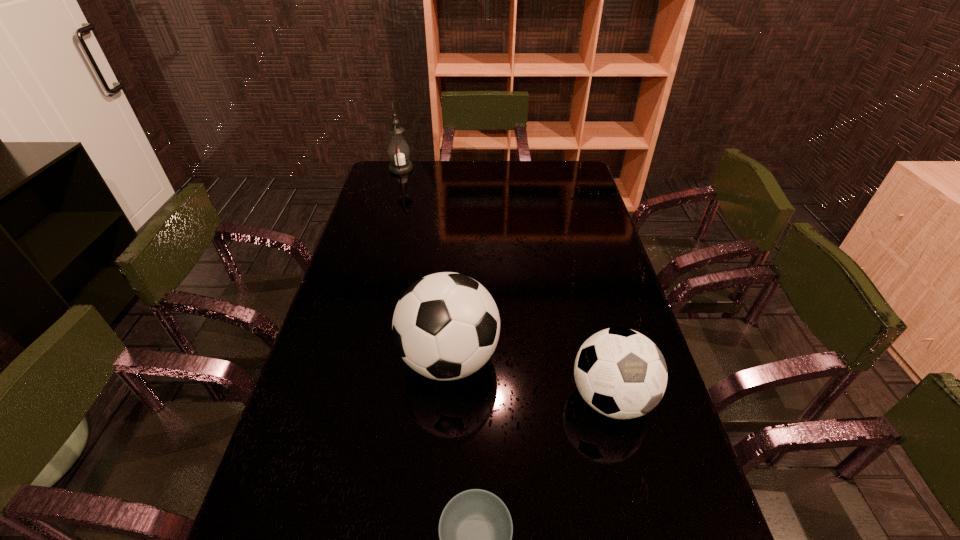
The width and height of the screenshot is (960, 540). Find the location of `oil lamp`. oil lamp is located at coordinates (398, 150).

Identify the location of the leftmost object. This screenshot has height=540, width=960. (398, 150).

You are a GUI agent. You are given a task and a screenshot of the screen. Output one action in this format:
    pyautogui.click(x=<x>, y=<y>)
    Task: Click on the taller soccer ball
    Image resolution: width=960 pixels, height=540 pixels.
    Given the screenshot: What is the action you would take?
    pyautogui.click(x=446, y=326)

At what (x,y) coordinates should I click in order to perform the action: click on the right soccer ball. Please return your answer as a coordinate pair (x, y). The height and width of the screenshot is (540, 960). Looking at the image, I should click on (620, 373).

The height and width of the screenshot is (540, 960). Identify the location of the rightmost object. (620, 373).

I want to click on vacant space located 0.400m on the front of the oil lamp, so click(384, 230).

This screenshot has width=960, height=540. I want to click on vacant space located on the back of the taller soccer ball, so click(x=452, y=310).

This screenshot has width=960, height=540. Identify the location of free spot located 0.090m on the main logo of the second shortest object. (631, 475).

Find the location of `object that is at the far edge`. object that is at the far edge is located at coordinates (398, 150).

The width and height of the screenshot is (960, 540). Find the location of `object present at the left edge`. object present at the left edge is located at coordinates (398, 150).